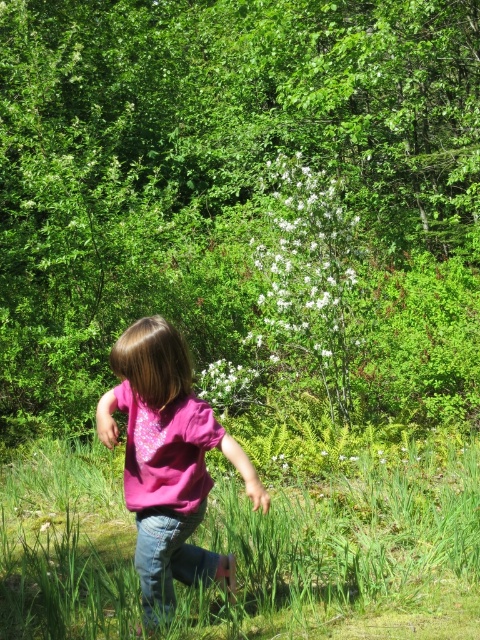
Question: Estimate the real-world distances between objects in this image. Which object is closer to the green grassy at center?

Choices:
 (A) white fluffy flowers at center
 (B) white matte flower at center
 (C) jeans at center

Answer: (C)

Question: Is green grassy at center positioned in front of white fluffy flowers at center?

Choices:
 (A) no
 (B) yes

Answer: (B)

Question: Does green grassy at center appear on the left side of white fluffy flowers at center?

Choices:
 (A) no
 (B) yes

Answer: (B)

Question: Which of the following is the closest to the observer?

Choices:
 (A) (332, 308)
 (B) (471, 464)
 (C) (159, 362)

Answer: (C)

Question: Which point appears farthest from the camera in this image?

Choices:
 (A) (267, 548)
 (B) (183, 392)
 (C) (311, 189)

Answer: (C)

Question: Is green grassy at center in front of white matte flower at center?

Choices:
 (A) yes
 (B) no

Answer: (A)